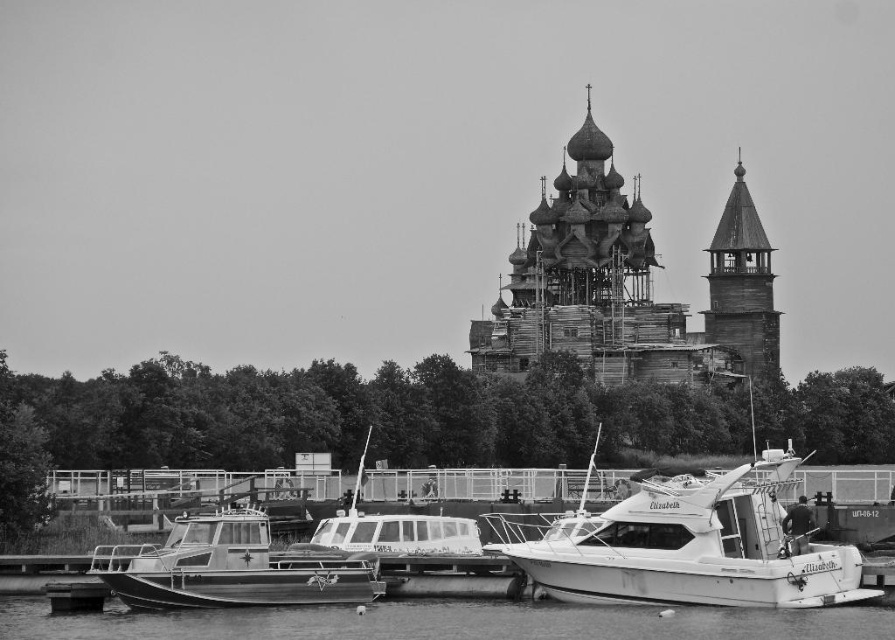
Is metallic gray boat at lower left behind wooden tower at upper right?

No, metallic gray boat at lower left is closer to the viewer.

Between metallic gray boat at lower left and wooden tower at upper right, which one is positioned lower?

metallic gray boat at lower left is lower down.

Is point (277, 595) positioned after point (718, 221)?

No, it is in front of (718, 221).

Image resolution: width=895 pixels, height=640 pixels. Find the location of `metallic gray boat at lower left`. metallic gray boat at lower left is located at coordinates pyautogui.click(x=232, y=566).

Is white matte boat at center to the right of smooth water at lower center from the viewer's perspective?

Correct, you'll find white matte boat at center to the right of smooth water at lower center.

Between point (675, 480) and point (43, 609), which one is positioned behind?

The point (43, 609) is more distant.

Find the location of a particular element. white matte boat at center is located at coordinates (691, 547).

Does point (740, 632) come in front of point (260, 538)?

Yes, it is.

Where is `smooth water at lower center`? smooth water at lower center is located at coordinates (445, 621).